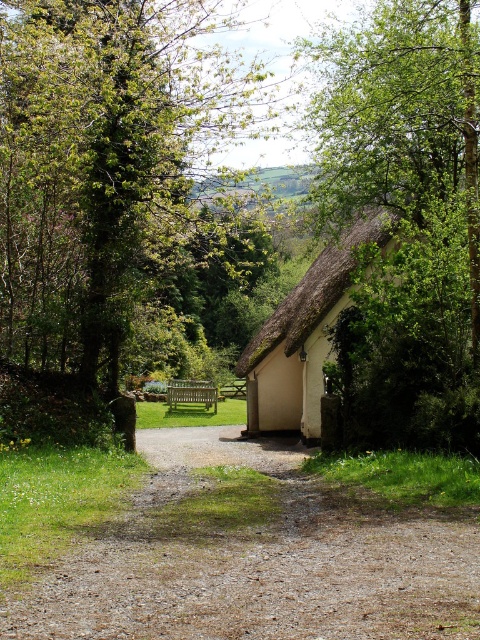
Question: In this image, where is gravel at center located relative to green leafy tree at upper right?

Choices:
 (A) above
 (B) below

Answer: (B)

Question: Which point is farther to the camera?

Choices:
 (A) wooden bench at center
 (B) gravel at center

Answer: (A)

Question: Is white thatched roof at center thinner than wooden bench at center?

Choices:
 (A) no
 (B) yes

Answer: (A)

Question: Which object is closer to the camera taking this photo?

Choices:
 (A) wooden bench at center
 (B) gravel at center
 (C) green leafy tree at upper left

Answer: (B)

Question: Estimate the real-world distances between objects in this image. Which object is farther from the green leafy tree at upper right?

Choices:
 (A) wooden picnic table at center
 (B) white thatched roof at center
 (C) gravel at center

Answer: (A)

Question: Can you confirm if wooden bench at center is thinner than wooden picnic table at center?

Choices:
 (A) no
 (B) yes

Answer: (A)